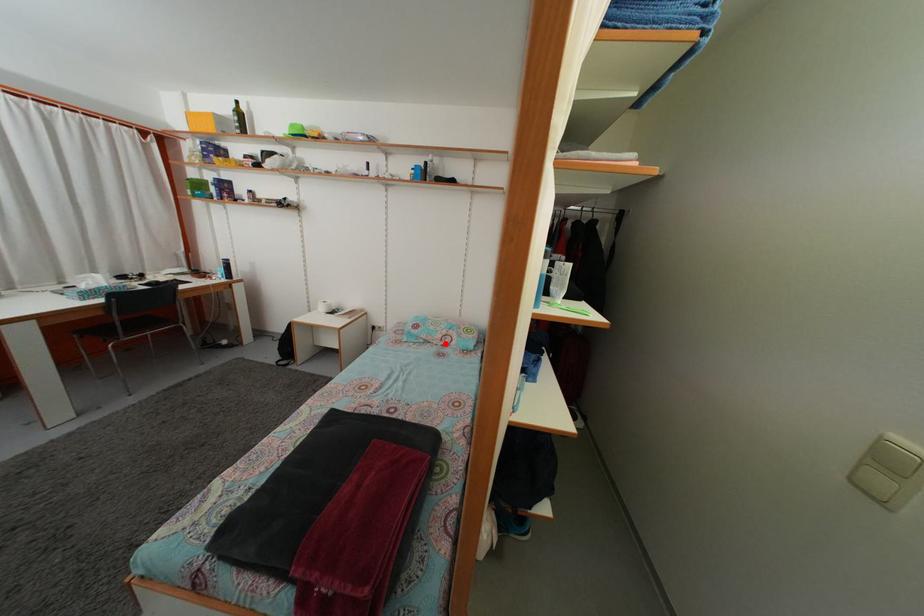
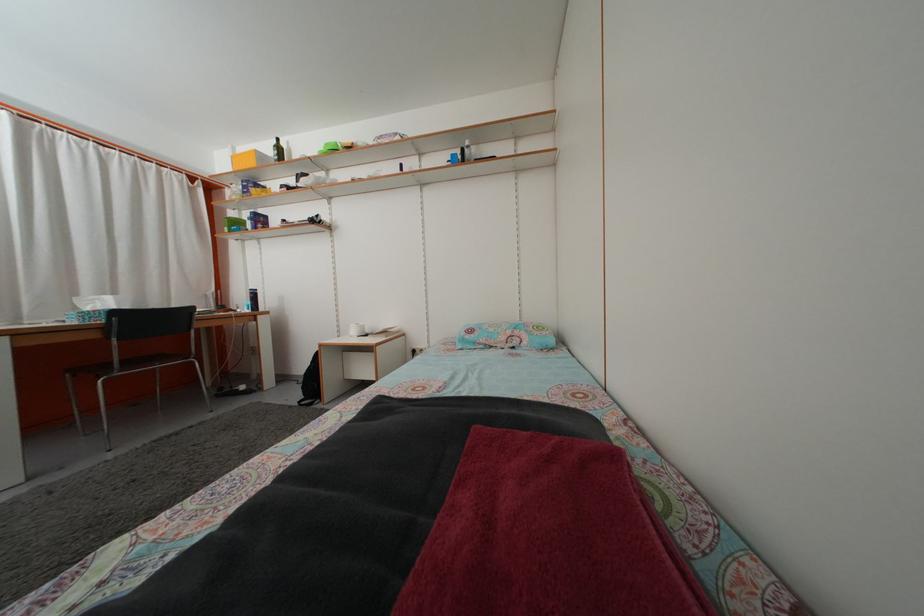
Where in the second image is the point corresponding to the highlighted location from the first image?

(508, 346)